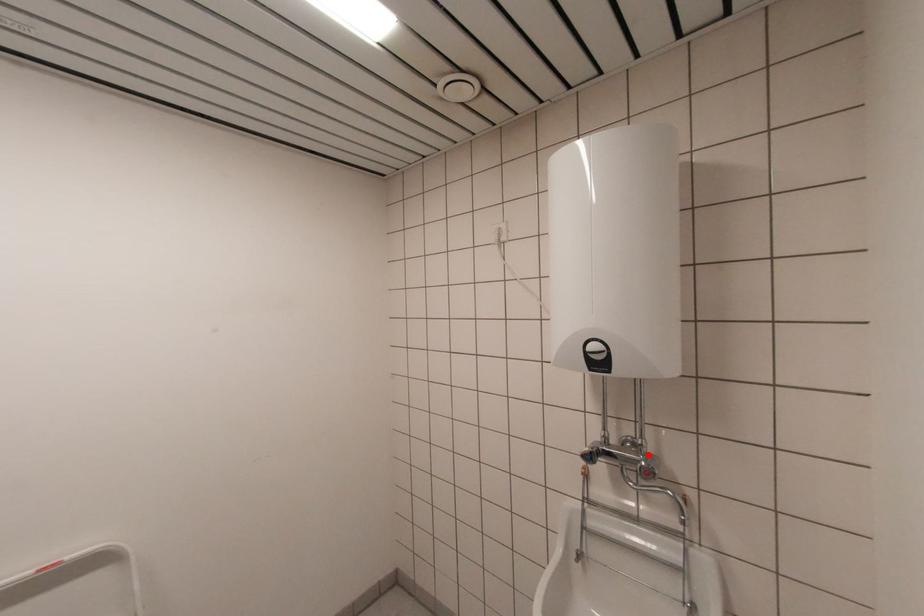
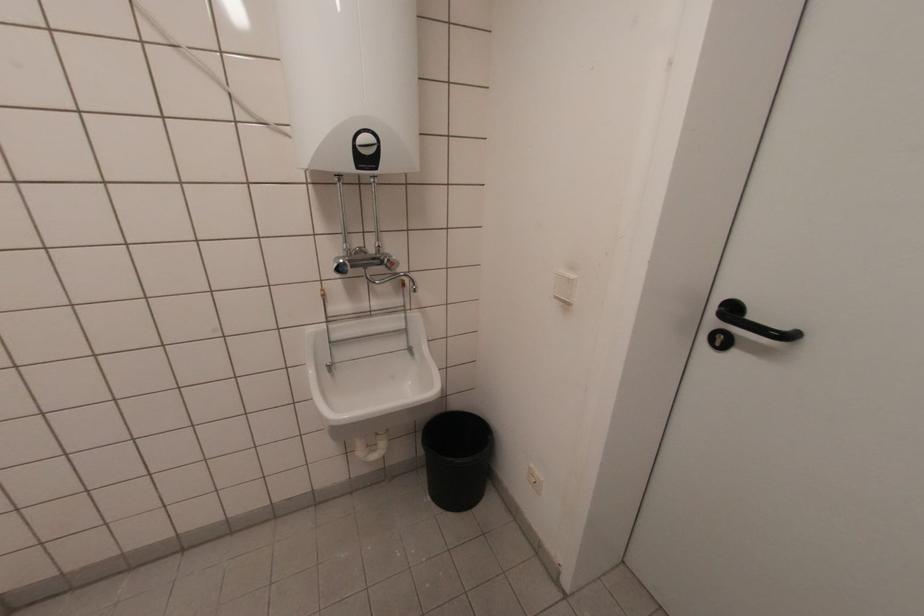
Find the pixel in the second image that matches the highlighted location in the first image.

(383, 254)